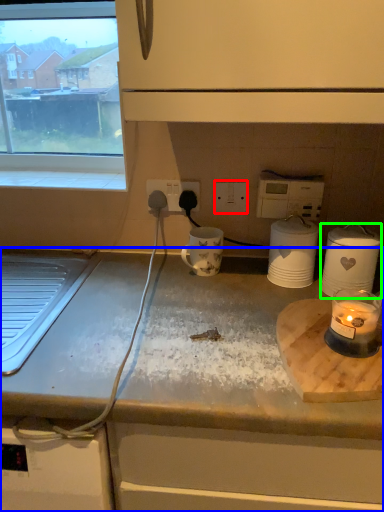
Question: Which is farther away from electric outlet (highlighted by a red box)? countertop (highlighted by a blue box) or kitchen appliance (highlighted by a green box)?

Choices:
 (A) countertop
 (B) kitchen appliance

Answer: (A)